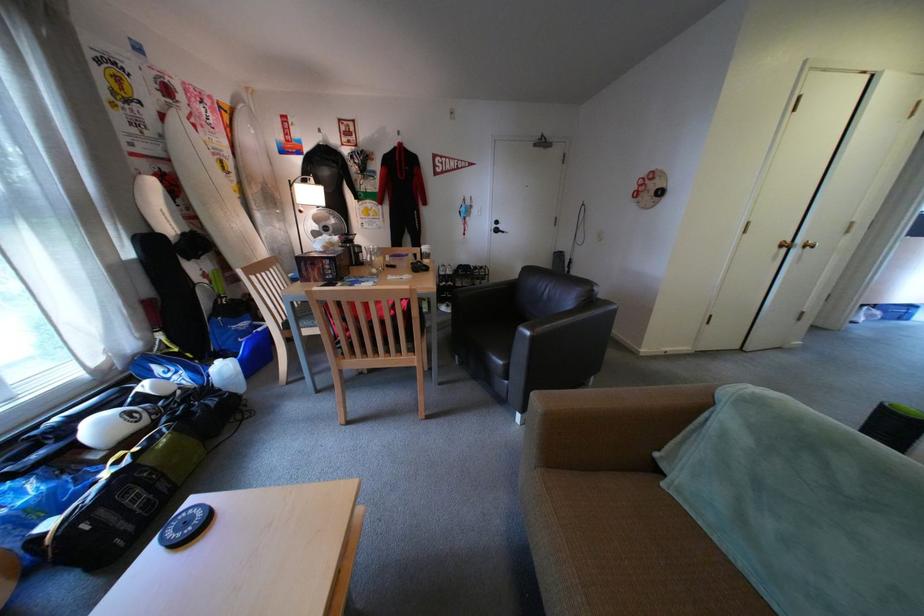
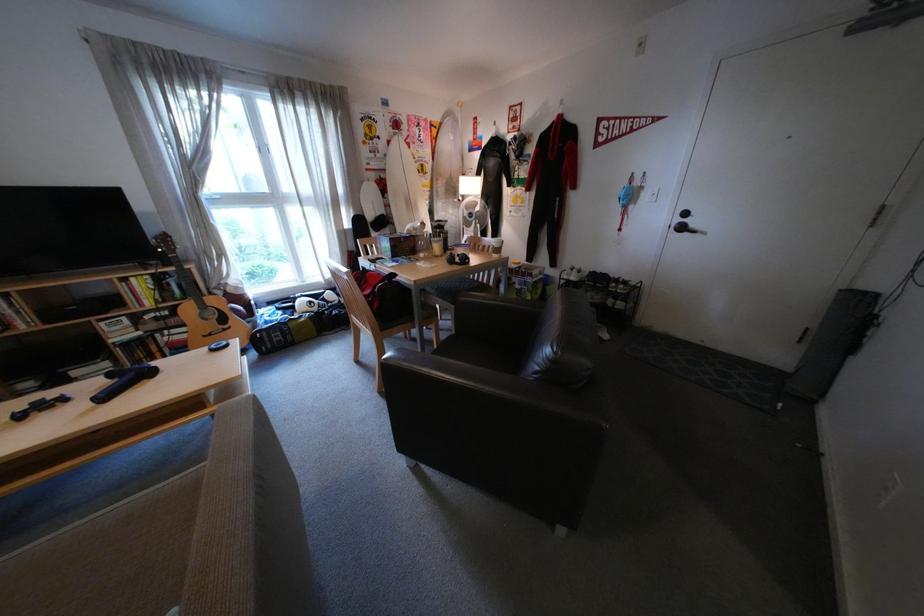
In the second image, find the point that corresponds to point 232,131 in the first image.

(439, 145)